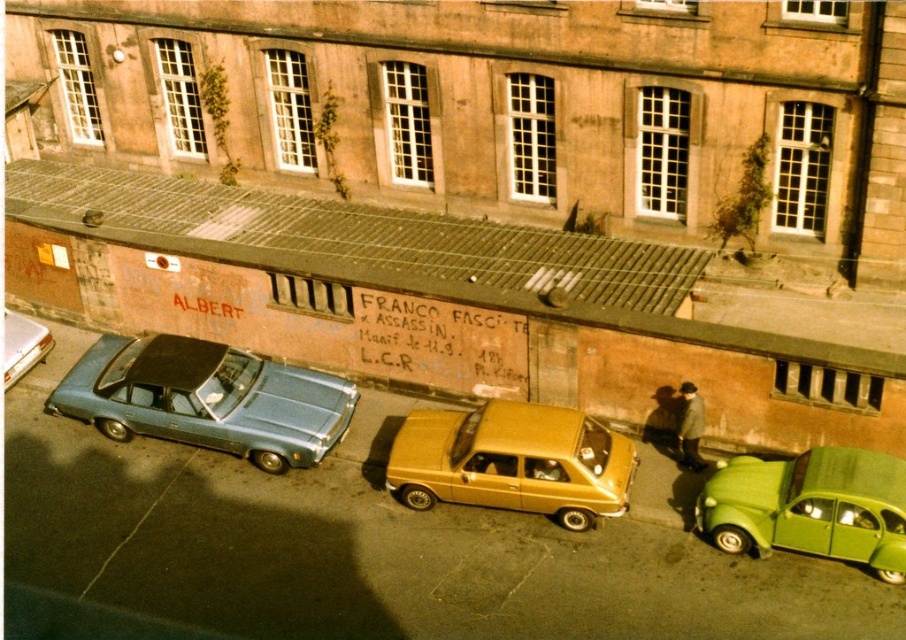
Question: Which object is positioned closest to the matte blue sedan at left?

Choices:
 (A) metallic gold sedan at center
 (B) metallic blue sedan at left
 (C) green matte car at lower right

Answer: (B)

Question: Which object is closer to the camera taking this photo?

Choices:
 (A) green matte car at lower right
 (B) metallic blue sedan at left
 (C) metallic gold sedan at center
 (D) matte blue sedan at left

Answer: (A)

Question: Where is matte blue sedan at left located in relation to metallic blue sedan at left in the image?

Choices:
 (A) below
 (B) above

Answer: (A)

Question: Is matte blue sedan at left to the right of metallic blue sedan at left from the viewer's perspective?

Choices:
 (A) no
 (B) yes

Answer: (B)

Question: Is matte blue sedan at left wider than metallic blue sedan at left?

Choices:
 (A) no
 (B) yes

Answer: (B)

Question: Which object appears closest to the camera in this image?

Choices:
 (A) green matte car at lower right
 (B) metallic gold sedan at center
 (C) metallic blue sedan at left

Answer: (A)